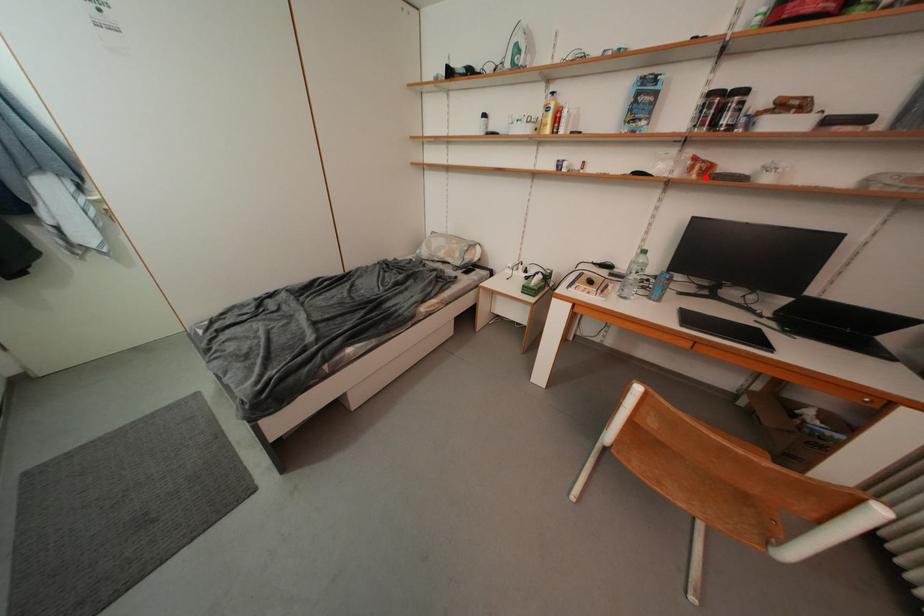
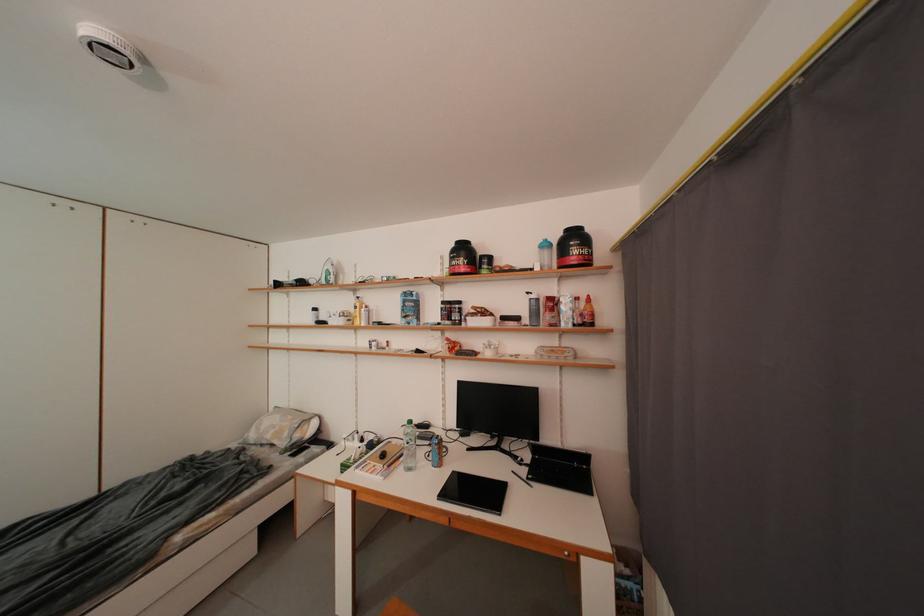
Question: I am providing you with two images of the same scene from different viewpoints. A red point is marked on the first image. Can you still see the location of the red point in image 2?

Choices:
 (A) Yes
 (B) No

Answer: (A)